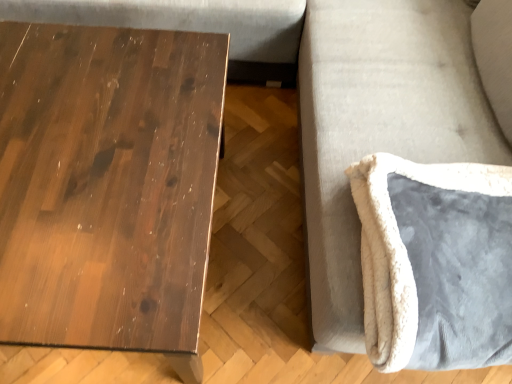
The height and width of the screenshot is (384, 512). Identify the location of dark wood table at left. (108, 186).

The height and width of the screenshot is (384, 512). Describe the element at coordinates (435, 262) in the screenshot. I see `velvet gray swivel chair at right` at that location.

What do you see at coordinates (379, 127) in the screenshot? I see `white plush cushion at lower right` at bounding box center [379, 127].

Find the location of `dark wood table at left`. dark wood table at left is located at coordinates [108, 186].

From the image's perspective, is velvet gray swivel chair at right above or below white plush cushion at lower right?

From the image's perspective, velvet gray swivel chair at right appears below white plush cushion at lower right.

Is velvet gray swivel chair at right inside the boundaries of white plush cushion at lower right, or outside?

velvet gray swivel chair at right can be found inside white plush cushion at lower right.

Image resolution: width=512 pixels, height=384 pixels. I want to click on couch directly beneath the velvet gray swivel chair at right (from a real-world perspective), so click(x=379, y=127).

From a real-world perspective, does velvet gray swivel chair at right sit lower than white plush cushion at lower right?

No, from a real-world perspective, velvet gray swivel chair at right is not beneath white plush cushion at lower right.

Is dark wood table at left further to camera compared to white plush cushion at lower right?

Yes, dark wood table at left is behind white plush cushion at lower right.

Between dark wood table at left and white plush cushion at lower right, which one has smaller width?

With smaller width is white plush cushion at lower right.

Considering the sizes of objects dark wood table at left and white plush cushion at lower right in the image provided, who is smaller, dark wood table at left or white plush cushion at lower right?

dark wood table at left is smaller.

Is dark wood table at left positioned far away from white plush cushion at lower right?

That's not correct — dark wood table at left is a little close to white plush cushion at lower right.

Is velvet gray swivel chair at right shorter than dark wood table at left?

Yes, velvet gray swivel chair at right is shorter than dark wood table at left.

From the image's perspective, is velvet gray swivel chair at right above dark wood table at left?

No.

Do you think velvet gray swivel chair at right is within dark wood table at left, or outside of it?

velvet gray swivel chair at right cannot be found inside dark wood table at left.

Does white plush cushion at lower right have a lesser height compared to velvet gray swivel chair at right?

In fact, white plush cushion at lower right may be taller than velvet gray swivel chair at right.

Is white plush cushion at lower right further to camera compared to velvet gray swivel chair at right?

No.

Consider the image. Considering the relative sizes of white plush cushion at lower right and velvet gray swivel chair at right in the image provided, is white plush cushion at lower right smaller than velvet gray swivel chair at right?

No.

Would you say white plush cushion at lower right is to the left or to the right of velvet gray swivel chair at right in the picture?

Based on their positions, white plush cushion at lower right is located to the right of velvet gray swivel chair at right.

Which is less distant, (426,60) or (153,36)?

Positioned in front is point (153,36).

From a real-world perspective, is white plush cushion at lower right positioned above or below dark wood table at left?

From a real-world perspective, white plush cushion at lower right is physically above dark wood table at left.

Based on the photo, from the image's perspective, is white plush cushion at lower right over dark wood table at left?

Yes, from the image's perspective, white plush cushion at lower right is on top of dark wood table at left.

Is white plush cushion at lower right not inside dark wood table at left?

That's correct, white plush cushion at lower right is outside of dark wood table at left.

Is dark wood table at left with velvet gray swivel chair at right?

They are not placed beside each other.

Which object is positioned more to the left, dark wood table at left or velvet gray swivel chair at right?

dark wood table at left is more to the left.

Does dark wood table at left come behind velvet gray swivel chair at right?

Yes, dark wood table at left is behind velvet gray swivel chair at right.

In terms of height, does dark wood table at left look taller or shorter compared to velvet gray swivel chair at right?

Clearly, dark wood table at left is taller compared to velvet gray swivel chair at right.

The image size is (512, 384). In order to click on swivel chair located above the white plush cushion at lower right (from a real-world perspective) in this screenshot , I will do `click(435, 262)`.

Find the location of a particular element. The image size is (512, 384). couch that is in front of the dark wood table at left is located at coordinates (379, 127).

Which object lies further to the anchor point dark wood table at left, velvet gray swivel chair at right or white plush cushion at lower right?

velvet gray swivel chair at right is further to dark wood table at left.

Estimate the real-world distances between objects in this image. Which object is closer to white plush cushion at lower right, velvet gray swivel chair at right or dark wood table at left?

velvet gray swivel chair at right.

Based on the photo, from the image, which object appears to be nearer to white plush cushion at lower right, dark wood table at left or velvet gray swivel chair at right?

velvet gray swivel chair at right.

Looking at the image, which one is located closer to dark wood table at left, white plush cushion at lower right or velvet gray swivel chair at right?

white plush cushion at lower right.

From the image, which object appears to be farther from velvet gray swivel chair at right, white plush cushion at lower right or dark wood table at left?

dark wood table at left is further to velvet gray swivel chair at right.

Looking at this image, when comparing their distances from velvet gray swivel chair at right, does dark wood table at left or white plush cushion at lower right seem further?

Among the two, dark wood table at left is located further to velvet gray swivel chair at right.

What are the coordinates of `swivel chair situated between dark wood table at left and white plush cushion at lower right from left to right` in the screenshot? It's located at (435, 262).